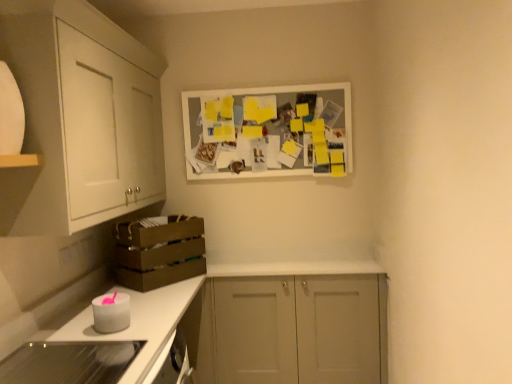
At what (x,y) coordinates should I click in order to perform the action: click on unoccupied area in front of white matte candle at lower left, the 1th appliance in the back-to-front sequence. Please return your answer as a coordinate pair (x, y). Looking at the image, I should click on (88, 342).